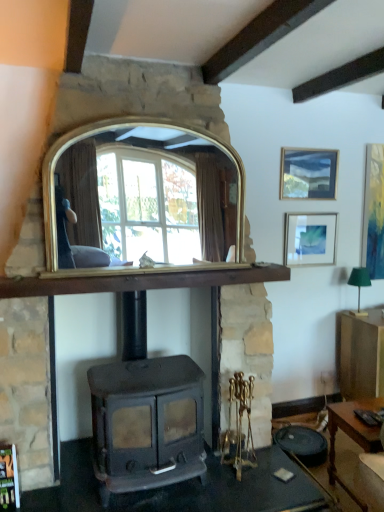
Question: Is point (332, 222) positioned closer to the camera than point (372, 156)?

Choices:
 (A) closer
 (B) farther

Answer: (A)

Question: From a real-world perspective, relative to matte gold picture frame at right, the third picture frame when ordered from left to right, is matte silver picture frame at upper right, arranged as the second picture frame when viewed from the right, vertically above or below?

Choices:
 (A) below
 (B) above

Answer: (A)

Question: Estimate the real-world distances between objects in this image. Which object is farther from the wooden desk at lower right?

Choices:
 (A) gold/glass mirror at center
 (B) matte gold picture frame at right, arranged as the 1th picture frame when viewed from the right
 (C) matte silver picture frame at upper right, which is the 2th picture frame in left-to-right order
 (D) matte wooden picture frame at upper right, placed as the first picture frame when sorted from left to right
 (E) green fabric lampshade at right

Answer: (D)

Question: Considering the real-world distances, which object is farthest from the matte gold picture frame at right, the third picture frame when ordered from left to right?

Choices:
 (A) matte black wood burning stove at center
 (B) matte wooden picture frame at upper right, placed as the first picture frame when sorted from left to right
 (C) green fabric lampshade at right
 (D) wooden mantel at center
 (E) gold/glass mirror at center

Answer: (A)